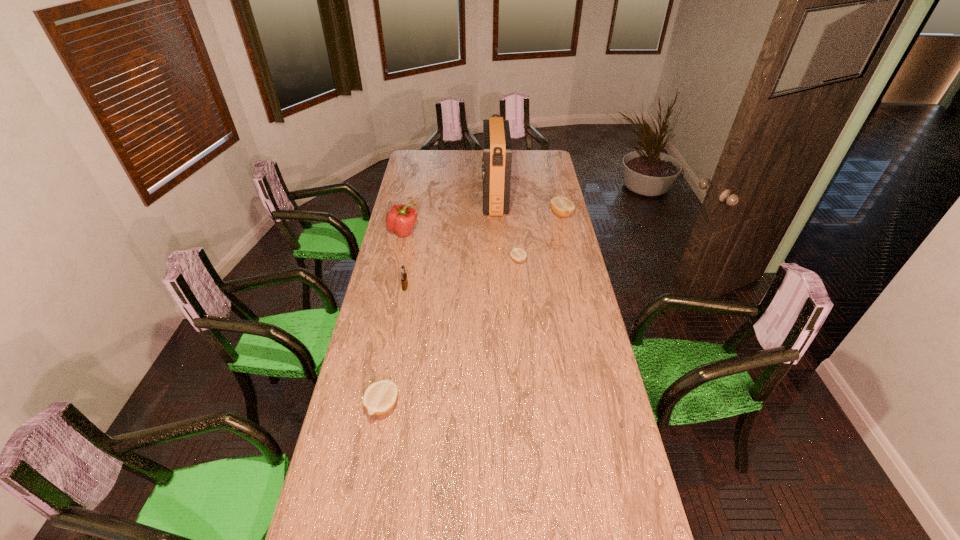
What are the coordinates of `free area in between the second shortest lemon and the second tallest object` in the screenshot? It's located at [x=393, y=319].

The image size is (960, 540). I want to click on vacant area that lies between the nearest object and the padlock, so click(x=394, y=346).

Where is `vacant space that is in between the pepper and the leftmost lemon`? Image resolution: width=960 pixels, height=540 pixels. vacant space that is in between the pepper and the leftmost lemon is located at coordinates (393, 319).

Identify the location of free area in between the shortest lemon and the second tallest object. (461, 246).

The width and height of the screenshot is (960, 540). Identify the location of free space between the shortest object and the second tallest object. (461, 246).

The height and width of the screenshot is (540, 960). Identify the location of empty space that is in between the padlock and the radio receiver. (450, 243).

Where is `empty space between the fifth farthest object and the rightmost object`? The width and height of the screenshot is (960, 540). empty space between the fifth farthest object and the rightmost object is located at coordinates (483, 251).

Select which object appears as the closest to the tallest object. Please provide its 2D coordinates. Your answer should be formatted as a tuple, i.e. [(x, y)], where the tuple contains the x and y coordinates of a point satisfying the conditions above.

[(562, 207)]

Image resolution: width=960 pixels, height=540 pixels. Find the location of `the second closest object relative to the third tallest object`. the second closest object relative to the third tallest object is located at coordinates (518, 255).

Locate an element on the screen. lemon that stands as the closest to the pepper is located at coordinates (518, 255).